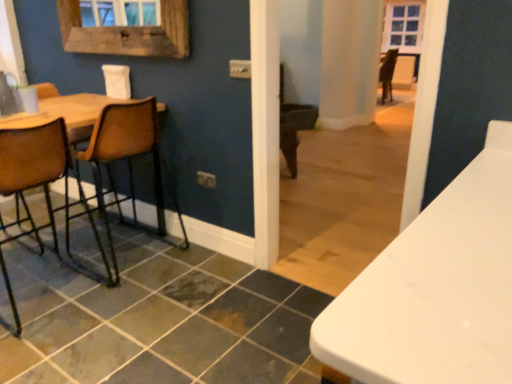
Question: Does slate tile at lower left lie in front of wooden frame at upper left?

Choices:
 (A) yes
 (B) no

Answer: (A)

Question: From the image's perspective, does slate tile at lower left appear higher than wooden frame at upper left?

Choices:
 (A) no
 (B) yes

Answer: (A)

Question: Is slate tile at lower left outside of wooden frame at upper left?

Choices:
 (A) no
 (B) yes

Answer: (B)

Question: Does slate tile at lower left have a lesser height compared to wooden frame at upper left?

Choices:
 (A) yes
 (B) no

Answer: (A)

Question: Would you say wooden frame at upper left is part of slate tile at lower left's contents?

Choices:
 (A) no
 (B) yes

Answer: (A)

Question: Considering the positions of brown leather chair at left, which is counted as the 1th chair, starting from the right, and slate tile at lower left in the image, is brown leather chair at left, which is counted as the 1th chair, starting from the right, wider or thinner than slate tile at lower left?

Choices:
 (A) thin
 (B) wide

Answer: (A)

Question: From a real-world perspective, is brown leather chair at left, which is counted as the 1th chair, starting from the right, positioned above or below slate tile at lower left?

Choices:
 (A) above
 (B) below

Answer: (A)

Question: From the image's perspective, is brown leather chair at left, which is counted as the 1th chair, starting from the right, located above or below slate tile at lower left?

Choices:
 (A) above
 (B) below

Answer: (A)

Question: Based on their sizes in the image, would you say brown leather chair at left, which is the 2th chair from left to right, is bigger or smaller than slate tile at lower left?

Choices:
 (A) big
 (B) small

Answer: (A)

Question: From a real-world perspective, relative to slate tile at lower left, is wooden seat at left, marked as the 1th chair in a left-to-right arrangement, vertically above or below?

Choices:
 (A) below
 (B) above

Answer: (B)

Question: Considering the positions of wooden seat at left, marked as the 1th chair in a left-to-right arrangement, and slate tile at lower left in the image, is wooden seat at left, marked as the 1th chair in a left-to-right arrangement, taller or shorter than slate tile at lower left?

Choices:
 (A) tall
 (B) short

Answer: (A)

Question: In the image, is wooden seat at left, marked as the 1th chair in a left-to-right arrangement, positioned in front of or behind slate tile at lower left?

Choices:
 (A) front
 (B) behind

Answer: (B)

Question: Does point (14, 147) appear closer or farther from the camera than point (123, 322)?

Choices:
 (A) farther
 (B) closer

Answer: (B)

Question: Is wooden frame at upper left taller or shorter than slate tile at lower left?

Choices:
 (A) short
 (B) tall

Answer: (B)

Question: In terms of width, does wooden frame at upper left look wider or thinner when compared to slate tile at lower left?

Choices:
 (A) wide
 (B) thin

Answer: (B)